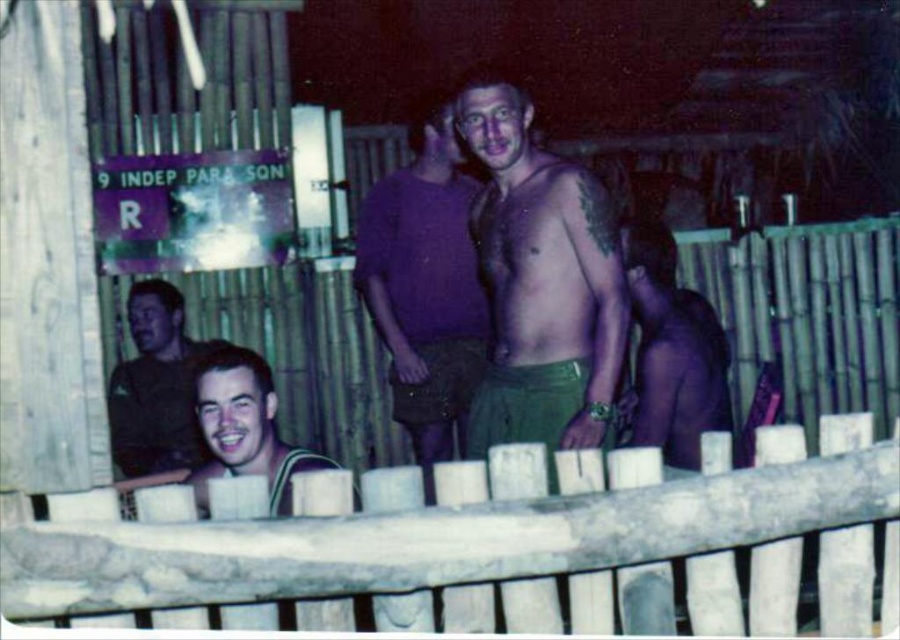
You are a photographer trying to capture a clear shot of both the green cotton shorts at center and the matte brown shirt at lower left. Since the camera can only focus on one subject at a time, which subject should you prioritize to ensure the other is still in the frame?

The green cotton shorts at center is positioned over matte brown shirt at lower left, so focusing on the green cotton shorts at center will keep the matte brown shirt at lower left in the frame below it.

In the scene shown: You are a photographer trying to capture a clear photo of both the shiny purple shirt at center and the matte brown shirt at lower left. Since the scene is dimly lit, you need to adjust your camera settings. Considering their positions, which shirt should you focus on first to ensure both are in focus?

The shiny purple shirt at center is in front of the matte brown shirt at lower left. To ensure both are in focus, you should focus on the shiny purple shirt at center first, as it is closer to the camera. This way, the depth of field will extend backward to include the matte brown shirt at lower left in focus as well.